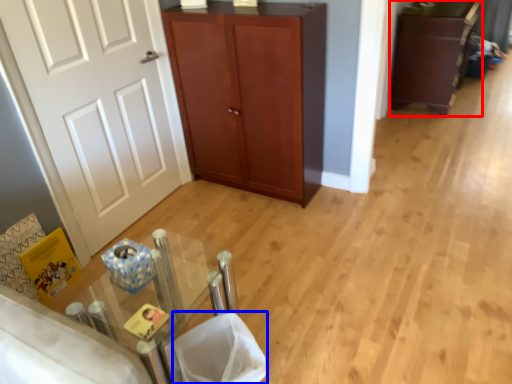
Question: Among these objects, which one is farthest to the camera, cabinetry (highlighted by a red box) or laundry basket (highlighted by a blue box)?

Choices:
 (A) cabinetry
 (B) laundry basket

Answer: (A)